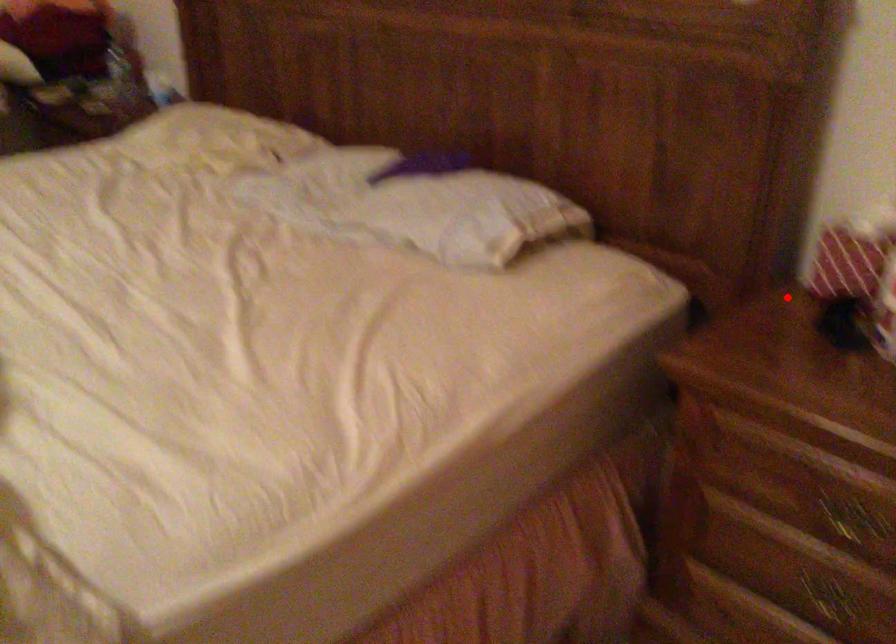
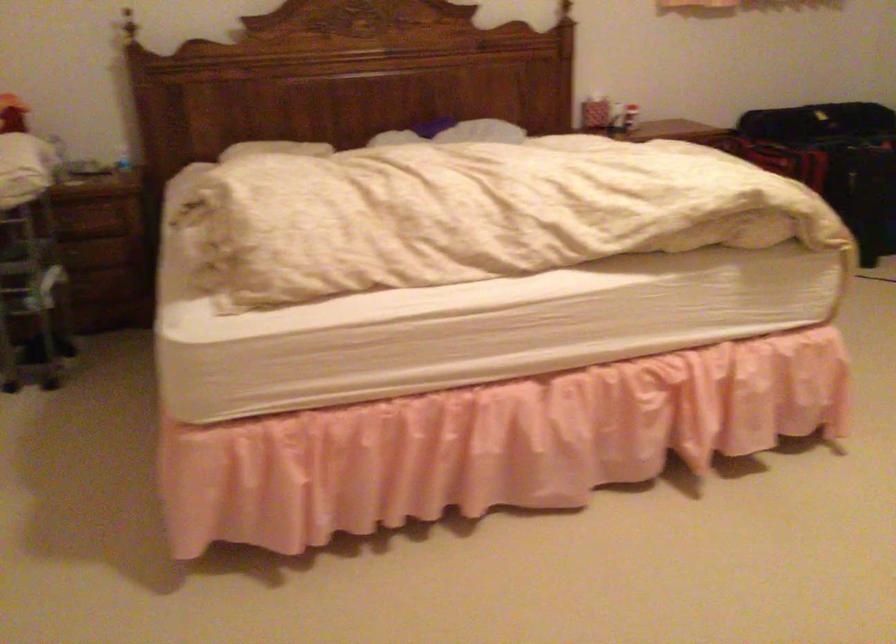
Question: A red point is marked in image1. In image2, is the corresponding 3D point closer to the camera or farther? Reply with the corresponding letter.

Choices:
 (A) The corresponding 3D point is closer.
 (B) The corresponding 3D point is farther.

Answer: (B)